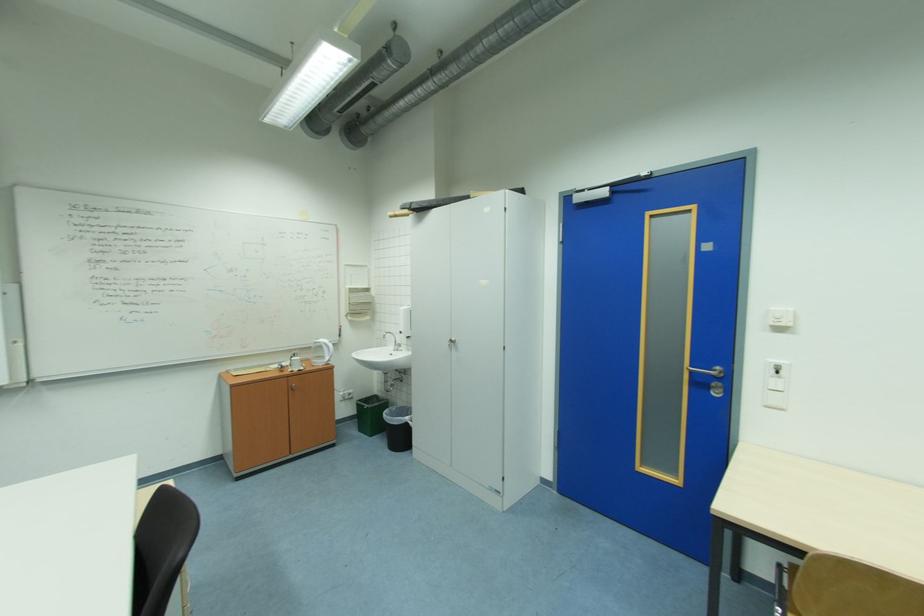
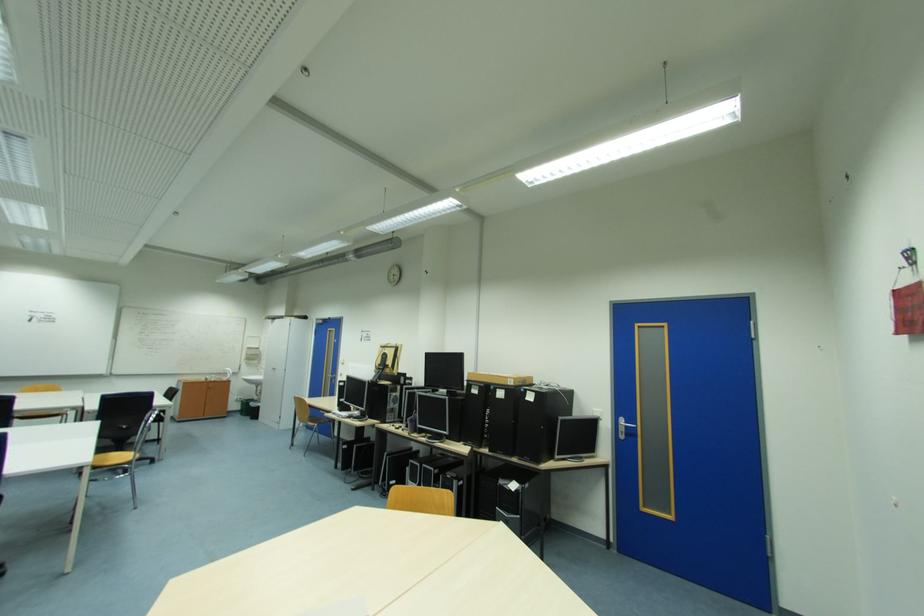
Locate, in the second image, the point that corresponds to (369,431) in the first image.

(249, 416)